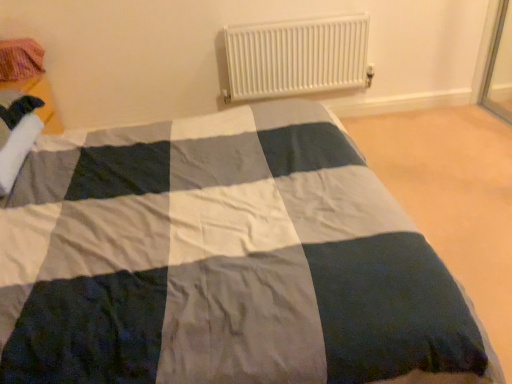
Find the location of a particular element. free spot above pink knitted fabric at upper left (from a real-world perspective) is located at coordinates (11, 41).